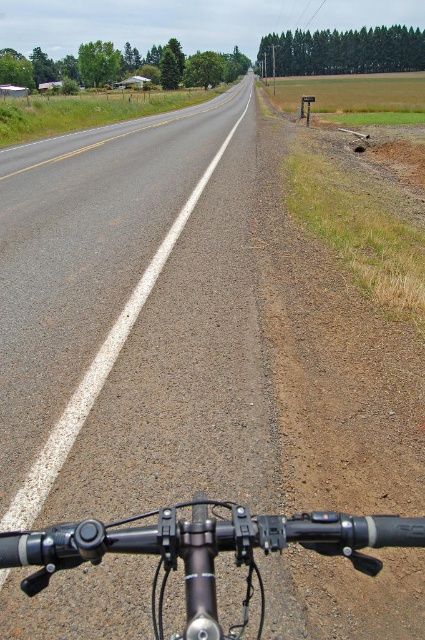
Question: Can you confirm if shiny black handlebars at bottom center is positioned to the left of asphalt road at center?

Choices:
 (A) yes
 (B) no

Answer: (B)

Question: Is shiny black handlebars at bottom center positioned before asphalt road at center?

Choices:
 (A) yes
 (B) no

Answer: (A)

Question: Which of the following is the closest to the observer?

Choices:
 (A) asphalt road at center
 (B) shiny black handlebars at bottom center

Answer: (B)

Question: Which of the following is the closest to the observer?

Choices:
 (A) (13, 518)
 (B) (275, 516)

Answer: (B)

Question: Does shiny black handlebars at bottom center come in front of asphalt road at center?

Choices:
 (A) no
 (B) yes

Answer: (B)